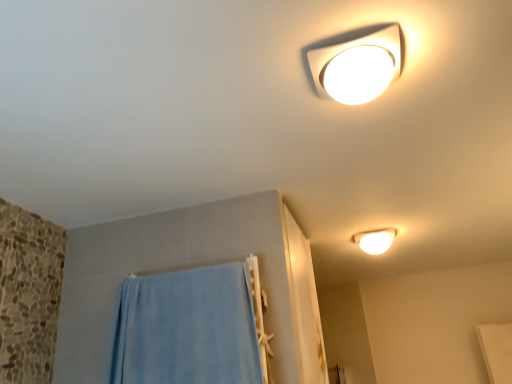
The width and height of the screenshot is (512, 384). Identify the location of white glossy lamp at upper center, which ranks as the 1th lamp in front-to-back order. (358, 66).

How much space does white glossy lamp at upper center, acting as the second lamp starting from the back, occupy vertically?

white glossy lamp at upper center, acting as the second lamp starting from the back, is 8.50 centimeters in height.

This screenshot has width=512, height=384. What do you see at coordinates (185, 329) in the screenshot? I see `blue soft towel at lower left` at bounding box center [185, 329].

At what (x,y) coordinates should I click in order to perform the action: click on white glossy light fixture at upper right, which is counted as the 2th lamp, starting from the top. Please return your answer as a coordinate pair (x, y). The image size is (512, 384). Looking at the image, I should click on (375, 240).

Looking at this image, from a real-world perspective, relative to blue soft towel at lower left, is white glossy lamp at upper center, the 2th lamp positioned from the right, vertically above or below?

Clearly, from a real-world perspective, white glossy lamp at upper center, the 2th lamp positioned from the right, is above blue soft towel at lower left.

Is white glossy lamp at upper center, which ranks as the 1th lamp in front-to-back order, to the left or to the right of blue soft towel at lower left in the image?

Clearly, white glossy lamp at upper center, which ranks as the 1th lamp in front-to-back order, is on the right of blue soft towel at lower left in the image.

Is white glossy lamp at upper center, which ranks as the 1th lamp in front-to-back order, taller than blue soft towel at lower left?

No.

Is there a large distance between white glossy lamp at upper center, acting as the second lamp starting from the back, and white glossy light fixture at upper right, which ranks as the 2th lamp in left-to-right order?

white glossy lamp at upper center, acting as the second lamp starting from the back, is far away from white glossy light fixture at upper right, which ranks as the 2th lamp in left-to-right order.

Considering the relative sizes of white glossy lamp at upper center, acting as the second lamp starting from the back, and white glossy light fixture at upper right, which is counted as the 2th lamp, starting from the top, in the image provided, is white glossy lamp at upper center, acting as the second lamp starting from the back, wider than white glossy light fixture at upper right, which is counted as the 2th lamp, starting from the top,?

No.

Locate an element on the screen. The height and width of the screenshot is (384, 512). lamp located on the left of white glossy light fixture at upper right, the 1th lamp from the bottom is located at coordinates (358, 66).

In the image, is blue soft towel at lower left on the left side or the right side of white glossy lamp at upper center, the 1th lamp positioned from the top?

blue soft towel at lower left is positioned on white glossy lamp at upper center, the 1th lamp positioned from the top,'s left side.

Who is smaller, blue soft towel at lower left or white glossy lamp at upper center, which is the first lamp in left-to-right order?

white glossy lamp at upper center, which is the first lamp in left-to-right order.

From the image's perspective, starting from the blue soft towel at lower left, which lamp is the 2nd one above? Please provide its 2D coordinates.

[(358, 66)]

Does blue soft towel at lower left turn towards white glossy lamp at upper center, acting as the second lamp starting from the back?

No, blue soft towel at lower left is not facing towards white glossy lamp at upper center, acting as the second lamp starting from the back.

Which is more to the left, white glossy light fixture at upper right, the 1th lamp from the bottom, or white glossy lamp at upper center, which ranks as the 1th lamp in front-to-back order?

From the viewer's perspective, white glossy lamp at upper center, which ranks as the 1th lamp in front-to-back order, appears more on the left side.

Is point (384, 247) less distant than point (368, 96)?

No, it is behind (368, 96).

Considering the sizes of white glossy light fixture at upper right, the 1th lamp from the bottom, and white glossy lamp at upper center, the 1th lamp positioned from the top, in the image, is white glossy light fixture at upper right, the 1th lamp from the bottom, taller or shorter than white glossy lamp at upper center, the 1th lamp positioned from the top,?

Clearly, white glossy light fixture at upper right, the 1th lamp from the bottom, is taller compared to white glossy lamp at upper center, the 1th lamp positioned from the top.

Is white glossy lamp at upper center, which ranks as the 1th lamp in front-to-back order, at the back of white glossy light fixture at upper right, positioned as the 1th lamp in back-to-front order?

No, white glossy light fixture at upper right, positioned as the 1th lamp in back-to-front order,'s orientation is not away from white glossy lamp at upper center, which ranks as the 1th lamp in front-to-back order.

In the scene shown: How much distance is there between white glossy light fixture at upper right, positioned as the 1th lamp in back-to-front order, and blue soft towel at lower left?

white glossy light fixture at upper right, positioned as the 1th lamp in back-to-front order, is 1.20 meters from blue soft towel at lower left.

Between white glossy light fixture at upper right, which is counted as the 2th lamp, starting from the top, and blue soft towel at lower left, which one has less height?

With less height is white glossy light fixture at upper right, which is counted as the 2th lamp, starting from the top.

Is point (394, 236) positioned behind point (164, 367)?

Yes, point (394, 236) is behind point (164, 367).

Is white glossy light fixture at upper right, positioned as the 1th lamp in back-to-front order, positioned behind blue soft towel at lower left?

Yes, white glossy light fixture at upper right, positioned as the 1th lamp in back-to-front order, is behind blue soft towel at lower left.

Between blue soft towel at lower left and white glossy light fixture at upper right, positioned as the 1th lamp in back-to-front order, which one appears on the right side from the viewer's perspective?

white glossy light fixture at upper right, positioned as the 1th lamp in back-to-front order, is more to the right.

Considering the relative sizes of blue soft towel at lower left and white glossy light fixture at upper right, arranged as the 2th lamp when viewed from the front, in the image provided, is blue soft towel at lower left bigger than white glossy light fixture at upper right, arranged as the 2th lamp when viewed from the front,?

Correct, blue soft towel at lower left is larger in size than white glossy light fixture at upper right, arranged as the 2th lamp when viewed from the front.

Considering the points (234, 347) and (366, 250), which point is in front, point (234, 347) or point (366, 250)?

Point (234, 347)

Is blue soft towel at lower left positioned with its back to white glossy light fixture at upper right, which is counted as the 2th lamp, starting from the top?

No, white glossy light fixture at upper right, which is counted as the 2th lamp, starting from the top, is not at the back of blue soft towel at lower left.

Where is `curtain that appears below the white glossy lamp at upper center, placed as the 2th lamp when sorted from bottom to top (from a real-world perspective)`? Image resolution: width=512 pixels, height=384 pixels. curtain that appears below the white glossy lamp at upper center, placed as the 2th lamp when sorted from bottom to top (from a real-world perspective) is located at coordinates (185, 329).

The width and height of the screenshot is (512, 384). Find the location of `lamp in front of the white glossy light fixture at upper right, which ranks as the 2th lamp in left-to-right order`. lamp in front of the white glossy light fixture at upper right, which ranks as the 2th lamp in left-to-right order is located at coordinates point(358,66).

Based on their spatial positions, is blue soft towel at lower left or white glossy light fixture at upper right, acting as the first lamp starting from the right, closer to white glossy lamp at upper center, which is the first lamp in left-to-right order?

Among the two, blue soft towel at lower left is located nearer to white glossy lamp at upper center, which is the first lamp in left-to-right order.

When comparing their distances from blue soft towel at lower left, does white glossy light fixture at upper right, which ranks as the 2th lamp in left-to-right order, or white glossy lamp at upper center, the 1th lamp positioned from the top, seem closer?

white glossy lamp at upper center, the 1th lamp positioned from the top, is positioned closer to the anchor blue soft towel at lower left.

Which object lies nearer to the anchor point blue soft towel at lower left, white glossy lamp at upper center, the 2th lamp positioned from the right, or white glossy light fixture at upper right, positioned as the 1th lamp in back-to-front order?

Among the two, white glossy lamp at upper center, the 2th lamp positioned from the right, is located nearer to blue soft towel at lower left.

Based on their spatial positions, is white glossy lamp at upper center, acting as the second lamp starting from the back, or blue soft towel at lower left closer to white glossy light fixture at upper right, which ranks as the 2th lamp in left-to-right order?

Based on the image, blue soft towel at lower left appears to be nearer to white glossy light fixture at upper right, which ranks as the 2th lamp in left-to-right order.

When comparing their distances from white glossy light fixture at upper right, which is counted as the 2th lamp, starting from the top, does blue soft towel at lower left or white glossy lamp at upper center, which ranks as the 1th lamp in front-to-back order, seem closer?

The object closer to white glossy light fixture at upper right, which is counted as the 2th lamp, starting from the top, is blue soft towel at lower left.

Estimate the real-world distances between objects in this image. Which object is closer to white glossy lamp at upper center, acting as the second lamp starting from the back, white glossy light fixture at upper right, acting as the first lamp starting from the right, or blue soft towel at lower left?

blue soft towel at lower left is closer to white glossy lamp at upper center, acting as the second lamp starting from the back.

Locate an element on the screen. curtain between white glossy lamp at upper center, which ranks as the 1th lamp in front-to-back order, and white glossy light fixture at upper right, acting as the first lamp starting from the right, in the front-back direction is located at coordinates (185, 329).